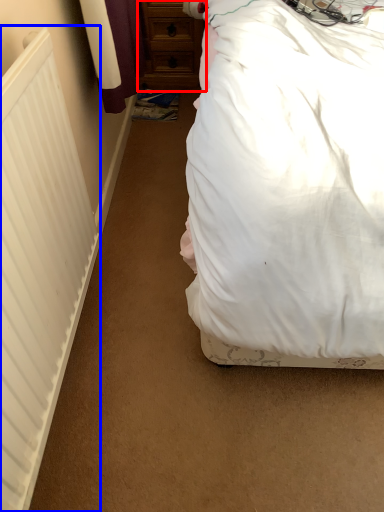
Question: Which object is further to the camera taking this photo, chest of drawers (highlighted by a red box) or radiator (highlighted by a blue box)?

Choices:
 (A) chest of drawers
 (B) radiator

Answer: (A)